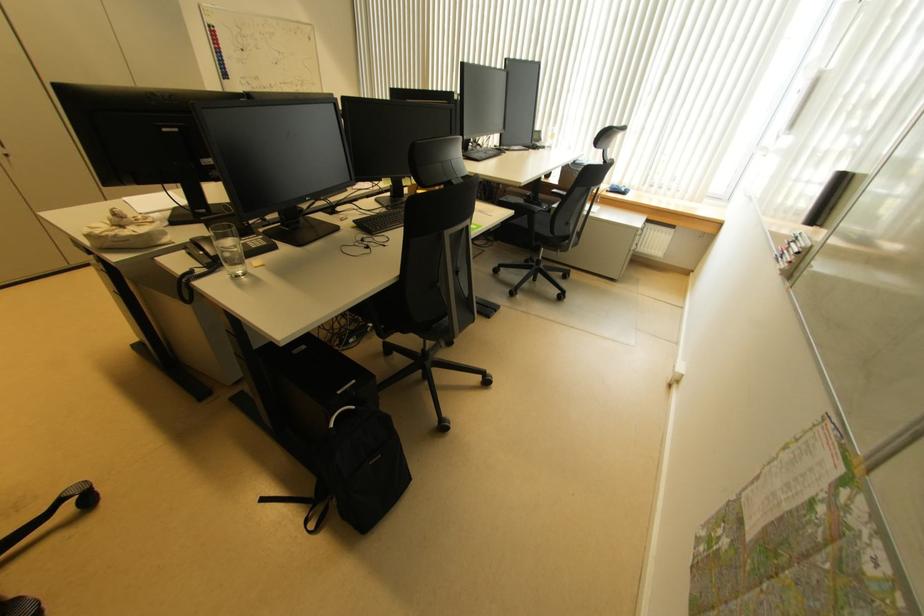
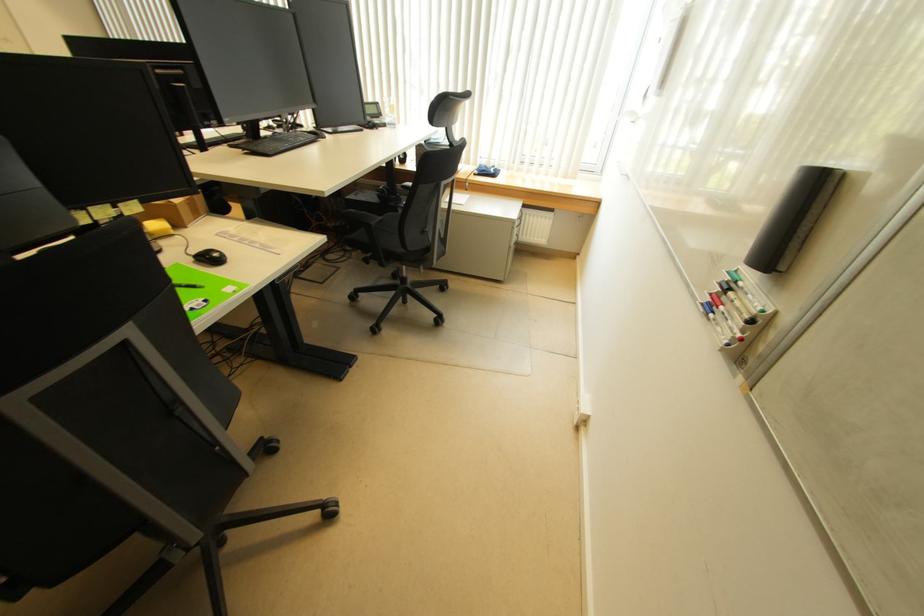
What movement of the cameraman would produce the second image?

The cameraman walked toward right, forward.